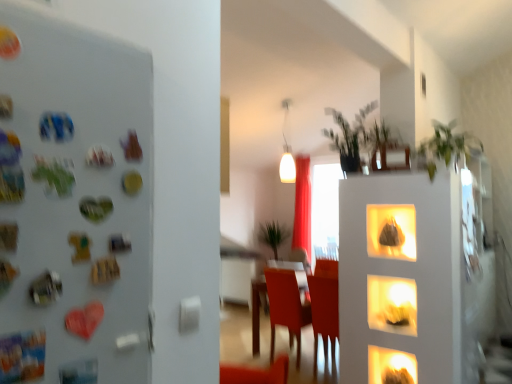
How much space does green leafy plant at center, placed as the 4th plant when sorted from front to back, occupy vertically?

It is 33.06 inches.

At what (x,y) coordinates should I click in order to perform the action: click on matte white shelf at center. Please return your answer as a coordinate pair (x, y). Looking at the image, I should click on (392, 304).

Find the location of `white glossy lamp at upper center`. white glossy lamp at upper center is located at coordinates (286, 152).

You are a GUI agent. You are given a task and a screenshot of the screen. Output one action in this format:
    pyautogui.click(x=<x>, y=<y>)
    Task: Click on the green leafy plant at upper right, the first plant positioned from the front
    This screenshot has width=512, height=384.
    Given the screenshot: What is the action you would take?
    pyautogui.click(x=447, y=146)

Consider the image. How much distance is there between matte white shelf at center and green leafy plant at center, acting as the 1th plant starting from the bottom?

matte white shelf at center and green leafy plant at center, acting as the 1th plant starting from the bottom, are 3.74 meters apart from each other.

From a real-world perspective, is matte white shelf at center positioned above or below green leafy plant at center, acting as the 1th plant starting from the bottom?

matte white shelf at center is situated lower than green leafy plant at center, acting as the 1th plant starting from the bottom, in the real world.

How different are the orientations of matte white shelf at center and green leafy plant at center, the first plant in the back-to-front sequence, in degrees?

matte white shelf at center and green leafy plant at center, the first plant in the back-to-front sequence, are facing 0.899 degrees away from each other.

Are matte white shelf at center and green leafy plant at center, placed as the 4th plant when sorted from front to back, far apart?

That's right, there is a large distance between matte white shelf at center and green leafy plant at center, placed as the 4th plant when sorted from front to back.

Is matte white shelf at center far from matte plastic chair at center?

Indeed, matte white shelf at center is not near matte plastic chair at center.

Choose the correct answer: Is matte white shelf at center inside matte plastic chair at center or outside it?

matte white shelf at center is located beyond the bounds of matte plastic chair at center.

Does point (407, 295) come in front of point (298, 301)?

Yes, it is in front of point (298, 301).

Based on the photo, considering the sizes of matte white shelf at center and red velvet curtain at center in the image, is matte white shelf at center bigger or smaller than red velvet curtain at center?

Considering their sizes, matte white shelf at center takes up less space than red velvet curtain at center.

From the image's perspective, which one is positioned lower, matte white shelf at center or red velvet curtain at center?

matte white shelf at center.

In the scene shown: Is matte white shelf at center wider than red velvet curtain at center?

Incorrect, the width of matte white shelf at center does not surpass that of red velvet curtain at center.

Considering the relative sizes of matte white shelf at center and red velvet curtain at center in the image provided, is matte white shelf at center taller than red velvet curtain at center?

No, matte white shelf at center is not taller than red velvet curtain at center.

Based on the photo, between matte plastic chair at center and red velvet curtain at center, which one has more height?

Standing taller between the two is red velvet curtain at center.

Considering the relative positions of matte plastic chair at center and red velvet curtain at center in the image provided, is matte plastic chair at center behind red velvet curtain at center?

No, the depth of matte plastic chair at center is less than that of red velvet curtain at center.

Does matte plastic chair at center have a greater width compared to red velvet curtain at center?

Yes, matte plastic chair at center is wider than red velvet curtain at center.

Does matte plastic chair at center appear on the left side of red velvet curtain at center?

Indeed, matte plastic chair at center is positioned on the left side of red velvet curtain at center.

From a real-world perspective, is green leafy plant at upper center, which is the second plant from back to front, positioned above or below green leafy plant at center, acting as the 1th plant starting from the bottom?

green leafy plant at upper center, which is the second plant from back to front, is situated higher than green leafy plant at center, acting as the 1th plant starting from the bottom, in the real world.

Can you confirm if green leafy plant at upper center, acting as the 4th plant starting from the bottom, is shorter than green leafy plant at center, acting as the 1th plant starting from the bottom?

Indeed, green leafy plant at upper center, acting as the 4th plant starting from the bottom, has a lesser height compared to green leafy plant at center, acting as the 1th plant starting from the bottom.

Does green leafy plant at upper center, the 3th plant when ordered from front to back, lie behind green leafy plant at center, placed as the 4th plant when sorted from front to back?

No.

Does point (326, 133) come farther from viewer compared to point (269, 240)?

No, it is not.

From a real-world perspective, which is physically below, green leafy plant at upper center, which is counted as the 3th plant, starting from the top, or green leafy plant at upper right, placed as the fourth plant when sorted from back to front?

From a 3D spatial view, green leafy plant at upper center, which is counted as the 3th plant, starting from the top, is below.

In the scene shown: Visually, is green leafy plant at upper center, which is counted as the 3th plant, starting from the top, positioned to the left or to the right of green leafy plant at upper right, the first plant positioned from the front?

Based on their positions, green leafy plant at upper center, which is counted as the 3th plant, starting from the top, is located to the left of green leafy plant at upper right, the first plant positioned from the front.

Between green leafy plant at upper center, which ranks as the 2th plant in front-to-back order, and green leafy plant at upper right, the first plant positioned from the front, which one has larger size?

With larger size is green leafy plant at upper right, the first plant positioned from the front.

In the scene shown: Is green leafy plant at upper center, the 2th plant ordered from the bottom, aimed at green leafy plant at upper right, the first plant positioned from the front?

No, green leafy plant at upper center, the 2th plant ordered from the bottom, is not oriented towards green leafy plant at upper right, the first plant positioned from the front.

Does green leafy plant at upper center, the 3th plant when ordered from front to back, appear on the right side of matte plastic chair at center?

Correct, you'll find green leafy plant at upper center, the 3th plant when ordered from front to back, to the right of matte plastic chair at center.

Who is shorter, green leafy plant at upper center, acting as the 4th plant starting from the bottom, or matte plastic chair at center?

green leafy plant at upper center, acting as the 4th plant starting from the bottom, is shorter.

Considering the relative sizes of green leafy plant at upper center, acting as the 4th plant starting from the bottom, and matte plastic chair at center in the image provided, is green leafy plant at upper center, acting as the 4th plant starting from the bottom, smaller than matte plastic chair at center?

Indeed, green leafy plant at upper center, acting as the 4th plant starting from the bottom, has a smaller size compared to matte plastic chair at center.

In terms of width, does green leafy plant at upper center, which is counted as the first plant, starting from the top, look wider or thinner when compared to matte plastic chair at center?

green leafy plant at upper center, which is counted as the first plant, starting from the top, is thinner than matte plastic chair at center.

Locate an element on the screen. The width and height of the screenshot is (512, 384). shelf on the right of the green leafy plant at center, placed as the 4th plant when sorted from front to back is located at coordinates (392, 304).

Find the location of a particular element. The height and width of the screenshot is (384, 512). armchair beneath the matte white shelf at center (from a real-world perspective) is located at coordinates [x=286, y=307].

Considering their positions, is white glossy lamp at upper center positioned closer to green leafy plant at upper center, which ranks as the 2th plant in front-to-back order, than matte plastic chair at center?

Among the two, matte plastic chair at center is located nearer to green leafy plant at upper center, which ranks as the 2th plant in front-to-back order.

Looking at the image, which one is located closer to red velvet curtain at center, green leafy plant at upper center, which is counted as the 3th plant, starting from the back, or matte white shelf at center?

green leafy plant at upper center, which is counted as the 3th plant, starting from the back, is closer to red velvet curtain at center.

Looking at the image, which one is located further to matte plastic chair at center, green leafy plant at center, the first plant in the back-to-front sequence, or matte white shelf at center?

green leafy plant at center, the first plant in the back-to-front sequence.

When comparing their distances from green leafy plant at upper right, acting as the third plant starting from the bottom, does white glossy lamp at upper center or matte plastic chair at center seem further?

white glossy lamp at upper center is further to green leafy plant at upper right, acting as the third plant starting from the bottom.

Based on their spatial positions, is matte white shelf at center or green leafy plant at upper center, the 2th plant ordered from the bottom, closer to green leafy plant at upper center, the 3th plant when ordered from front to back?

green leafy plant at upper center, the 2th plant ordered from the bottom.

Based on their spatial positions, is matte white shelf at center or green leafy plant at upper center, which is counted as the 3th plant, starting from the back, further from red velvet curtain at center?

The object further to red velvet curtain at center is matte white shelf at center.

Which object lies nearer to the anchor point matte plastic chair at center, green leafy plant at upper center, acting as the 4th plant starting from the bottom, or green leafy plant at upper center, which is counted as the 3th plant, starting from the top?

green leafy plant at upper center, acting as the 4th plant starting from the bottom, is closer to matte plastic chair at center.

Considering their positions, is white glossy lamp at upper center positioned closer to red velvet curtain at center than green leafy plant at center, acting as the 1th plant starting from the bottom?

Based on the image, white glossy lamp at upper center appears to be nearer to red velvet curtain at center.

In order to click on shelf between green leafy plant at upper right, the first plant positioned from the front, and matte plastic chair at center in the up-down direction in this screenshot , I will do `click(392, 304)`.

I want to click on lamp between green leafy plant at upper right, placed as the fourth plant when sorted from back to front, and red velvet curtain at center from front to back, so click(x=286, y=152).

Where is `shelf positioned between green leafy plant at upper right, acting as the third plant starting from the bottom, and red velvet curtain at center from near to far`? shelf positioned between green leafy plant at upper right, acting as the third plant starting from the bottom, and red velvet curtain at center from near to far is located at coordinates (392, 304).

This screenshot has width=512, height=384. I want to click on lamp between matte plastic chair at center and red velvet curtain at center along the z-axis, so click(286, 152).